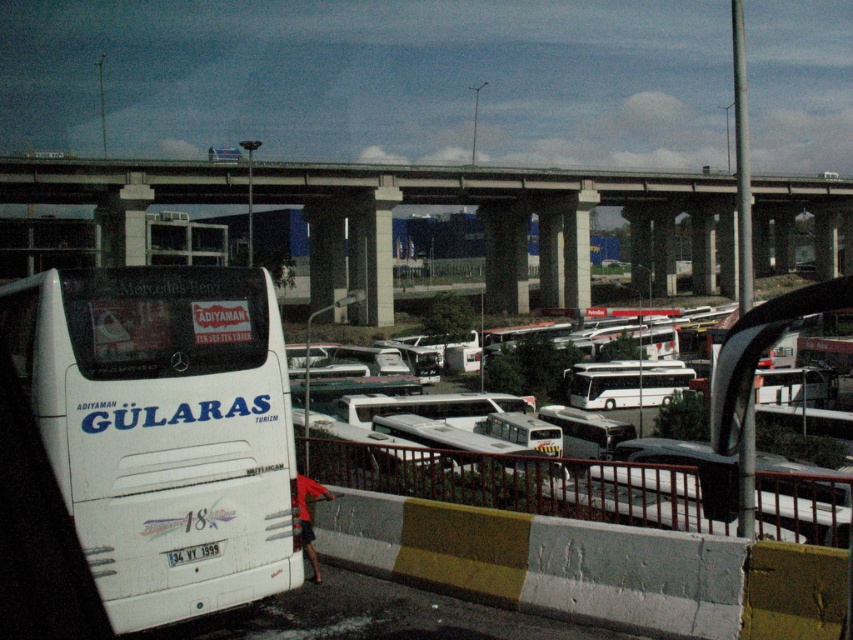
Is point (132, 508) farther from viewer compared to point (386, 172)?

No, (132, 508) is in front of (386, 172).

Between white matte bus at left and concrete at center, which one appears on the left side from the viewer's perspective?

white matte bus at left is more to the left.

Who is more forward, (277, 436) or (144, 193)?

Point (277, 436) is more forward.

What are the coordinates of `white matte bus at left` in the screenshot? It's located at (163, 428).

Which is more to the right, white matte bus at left or white plastic license plate at lower center?

From the viewer's perspective, white plastic license plate at lower center appears more on the right side.

Between white matte bus at left and white plastic license plate at lower center, which one is positioned lower?

white plastic license plate at lower center is lower down.

Is point (212, 419) positioned in front of point (189, 561)?

No, (212, 419) is behind (189, 561).

Locate an element on the screen. The image size is (853, 640). white matte bus at left is located at coordinates (163, 428).

Does concrete at center appear on the left side of white plastic license plate at lower center?

Incorrect, concrete at center is not on the left side of white plastic license plate at lower center.

Can you confirm if concrete at center is thinner than white plastic license plate at lower center?

No.

Identify the location of concrete at center. The height and width of the screenshot is (640, 853). (409, 202).